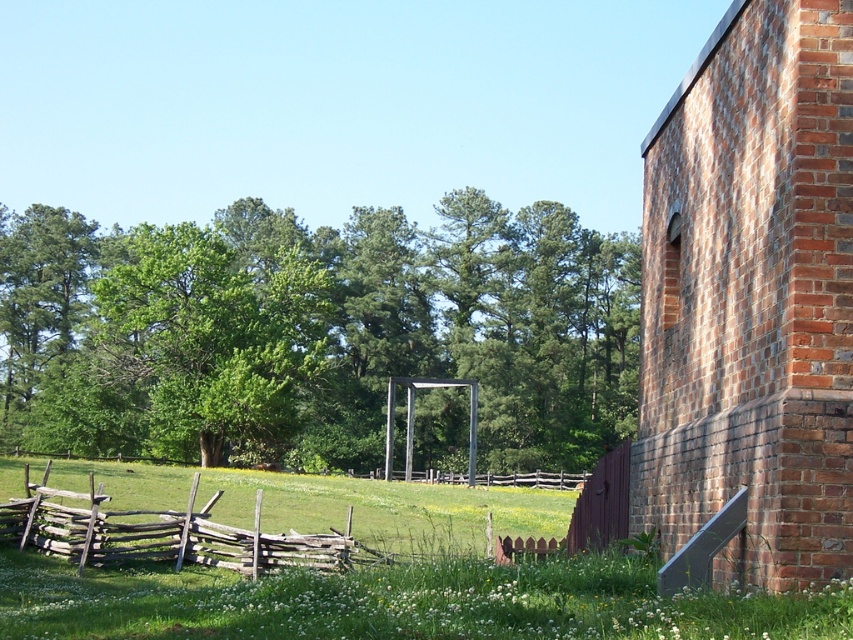
Between point (215, 420) and point (757, 99), which one is positioned in front?

Point (757, 99) is in front.

The image size is (853, 640). What do you see at coordinates (316, 332) in the screenshot?
I see `green leafy tree at center` at bounding box center [316, 332].

Who is more distant from viewer, [216,353] or [833,552]?

The point [216,353] is more distant.

Find the location of a particular element. The height and width of the screenshot is (640, 853). green leafy tree at center is located at coordinates (316, 332).

Measure the distance between brown wooden fence at lower right and brown wooden fence at center.

They are 48.26 meters apart.

Which is more to the left, brown wooden fence at lower right or brown wooden fence at center?

Positioned to the left is brown wooden fence at center.

Is point (567, 536) closer to camera compared to point (512, 472)?

Yes, point (567, 536) is closer to viewer.

At what (x,y) coordinates should I click in order to perform the action: click on brown wooden fence at lower right. Please return your answer as a coordinate pair (x, y). Image resolution: width=853 pixels, height=640 pixels. Looking at the image, I should click on (585, 513).

Based on the photo, how much distance is there between green leafy tree at center and weathered wood fence at lower left?

The distance of green leafy tree at center from weathered wood fence at lower left is 60.66 meters.

Is point (270, 436) positioned before point (125, 524)?

No, it is behind (125, 524).

Where is `green leafy tree at center`? green leafy tree at center is located at coordinates (316, 332).